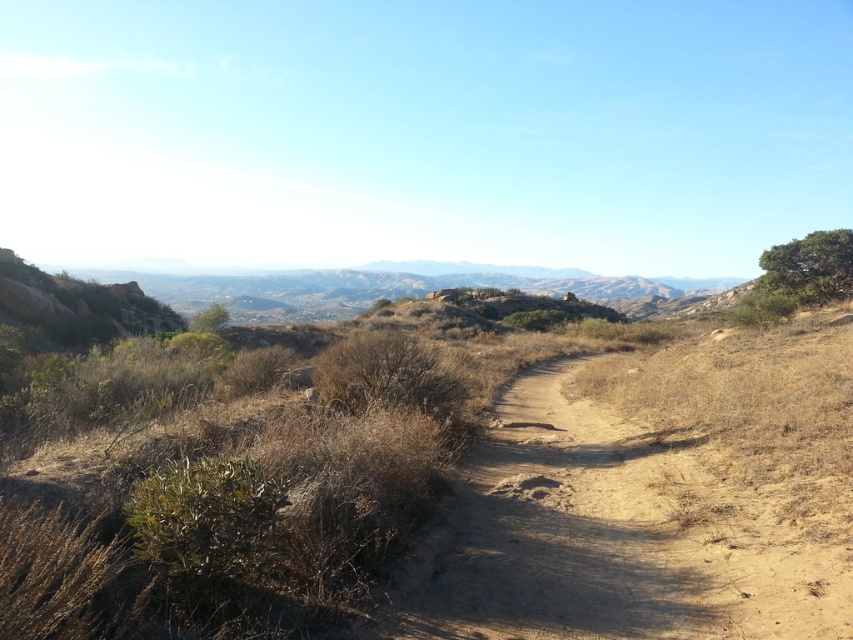
Question: Which point is closer to the camera taking this photo?

Choices:
 (A) (848, 260)
 (B) (672, 593)

Answer: (B)

Question: Considering the relative positions of dried dirt path at center and green leafy tree at upper right in the image provided, where is dried dirt path at center located with respect to green leafy tree at upper right?

Choices:
 (A) above
 (B) below

Answer: (B)

Question: Is the position of dried dirt path at center less distant than that of green leafy tree at upper right?

Choices:
 (A) no
 (B) yes

Answer: (B)

Question: Can you confirm if dried dirt path at center is positioned above green leafy tree at upper right?

Choices:
 (A) yes
 (B) no

Answer: (B)

Question: Which of the following is the farthest from the observer?

Choices:
 (A) (811, 262)
 (B) (549, 512)

Answer: (A)